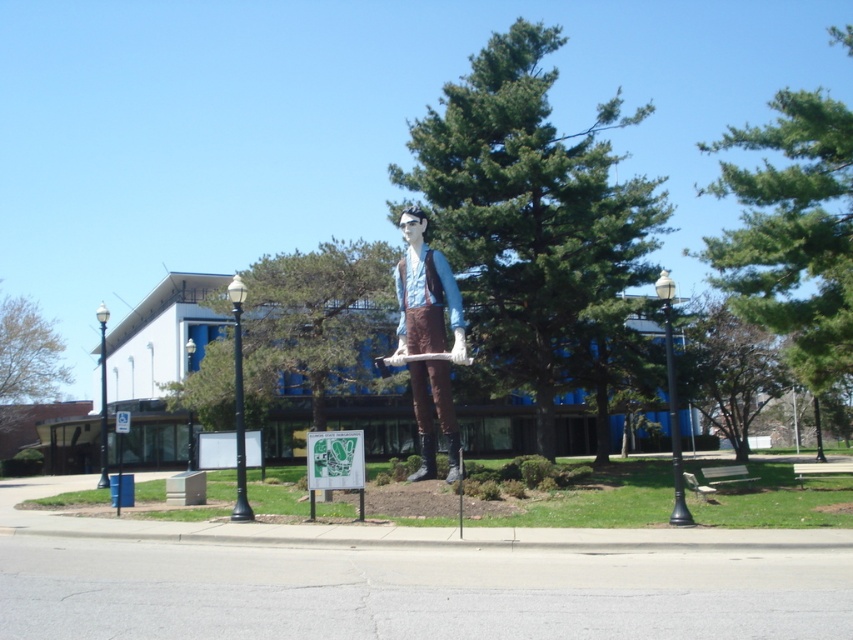
Question: Does green textured tree at center appear under brushed metal pole at left?

Choices:
 (A) no
 (B) yes

Answer: (A)

Question: Which point is closer to the camera?

Choices:
 (A) green leafy tree at upper right
 (B) matte blue shirt at center
 (C) black metal pole at right

Answer: (C)

Question: Which point is closer to the camera?

Choices:
 (A) green textured tree at center
 (B) matte blue shirt at center
 (C) black metal pole at right
 (D) black metal pole at left

Answer: (C)

Question: Is black metal pole at right below white plastic sign at center?

Choices:
 (A) no
 (B) yes

Answer: (A)

Question: Estimate the real-world distances between objects in this image. Which object is closer to the green leafy tree at upper left?

Choices:
 (A) green leafy tree at upper center
 (B) brushed metal pole at left
 (C) black metal pole at right

Answer: (B)

Question: Does matte blue shirt at center appear on the right side of black metal pole at left?

Choices:
 (A) no
 (B) yes

Answer: (B)